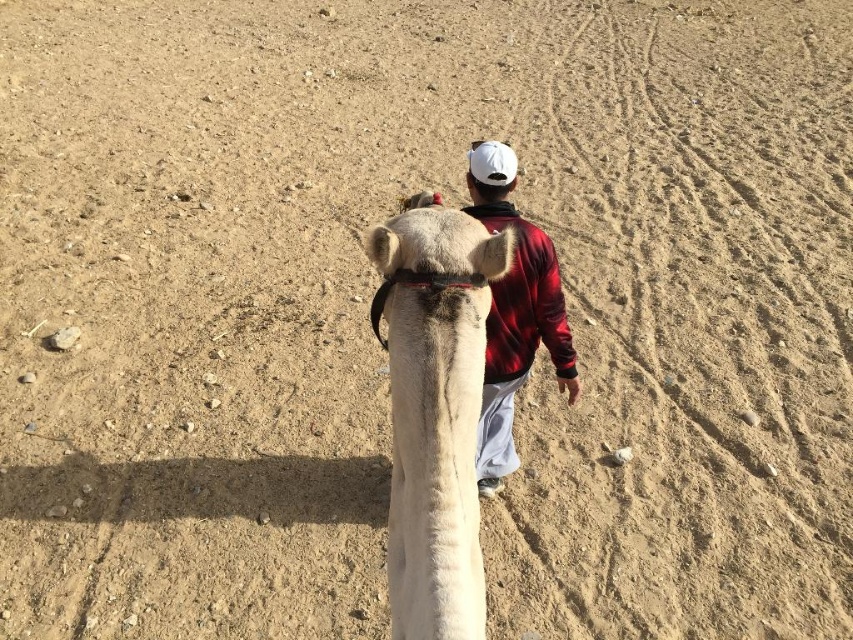
You are a photographer standing at the edge of the desert. You have a camera with a lens that can capture objects up to 2 meters wide. You see the fuzzy beige camel at center and the white matte baseball hat at upper center. Can your camera lens capture both objects in a single frame without zooming?

The fuzzy beige camel at center might be wider than white matte baseball hat at upper center. Since the camel could be wider than the hat, and the camera can capture up to 2 meters wide, you need to check the camel width. If the camel is within 2 meters, it will fit. However, since the description says the camel might be wider, there is uncertainty. The answer should reflect that possibility.

You are a traveler in the desert and you see a fuzzy beige camel at center and a red plaid jacket at center. Which object is taller?

The red plaid jacket at center is taller than the fuzzy beige camel at center.